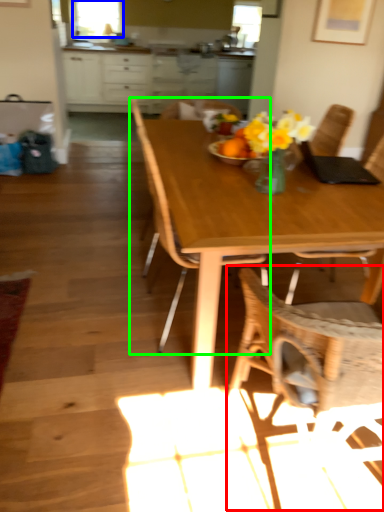
Question: Estimate the real-world distances between objects in this image. Which object is farther from chair (highlighted by a red box), window screen (highlighted by a blue box) or chair (highlighted by a green box)?

Choices:
 (A) window screen
 (B) chair

Answer: (A)